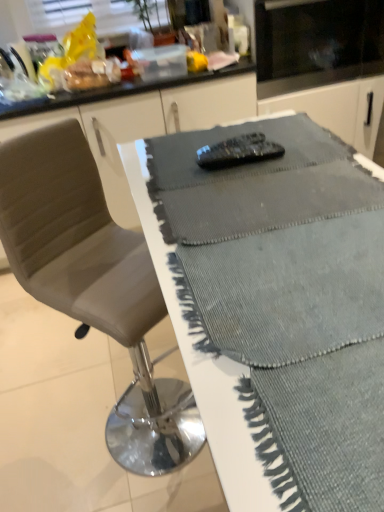
Question: Can you confirm if leather-like gray chair at center is thinner than black glass microwave at upper center?

Choices:
 (A) no
 (B) yes

Answer: (A)

Question: Can you see leather-like gray chair at center touching black glass microwave at upper center?

Choices:
 (A) no
 (B) yes

Answer: (A)

Question: From a real-world perspective, does leather-like gray chair at center stand above black glass microwave at upper center?

Choices:
 (A) yes
 (B) no

Answer: (B)

Question: Does leather-like gray chair at center lie in front of black glass microwave at upper center?

Choices:
 (A) yes
 (B) no

Answer: (A)

Question: Considering the relative positions of leather-like gray chair at center and black glass microwave at upper center in the image provided, is leather-like gray chair at center to the right of black glass microwave at upper center from the viewer's perspective?

Choices:
 (A) yes
 (B) no

Answer: (B)

Question: Is black glass microwave at upper center inside or outside of leather-like gray chair at center?

Choices:
 (A) inside
 (B) outside

Answer: (B)

Question: From the image's perspective, is black glass microwave at upper center above or below leather-like gray chair at center?

Choices:
 (A) below
 (B) above

Answer: (B)

Question: In terms of size, does black glass microwave at upper center appear bigger or smaller than leather-like gray chair at center?

Choices:
 (A) big
 (B) small

Answer: (A)

Question: From a real-world perspective, is black glass microwave at upper center physically located above or below leather-like gray chair at center?

Choices:
 (A) above
 (B) below

Answer: (A)

Question: In terms of height, does textured gray table at center look taller or shorter compared to leather-like gray chair at center?

Choices:
 (A) tall
 (B) short

Answer: (B)

Question: Considering the positions of point (304, 198) and point (96, 264), is point (304, 198) closer or farther from the camera than point (96, 264)?

Choices:
 (A) closer
 (B) farther

Answer: (A)

Question: From a real-world perspective, is textured gray table at center positioned above or below leather-like gray chair at center?

Choices:
 (A) above
 (B) below

Answer: (A)

Question: From the image's perspective, is textured gray table at center located above or below leather-like gray chair at center?

Choices:
 (A) above
 (B) below

Answer: (A)

Question: Does point (380, 51) appear closer or farther from the camera than point (218, 470)?

Choices:
 (A) closer
 (B) farther

Answer: (B)

Question: In the image, is black glass microwave at upper center positioned in front of or behind textured gray table at center?

Choices:
 (A) behind
 (B) front

Answer: (A)